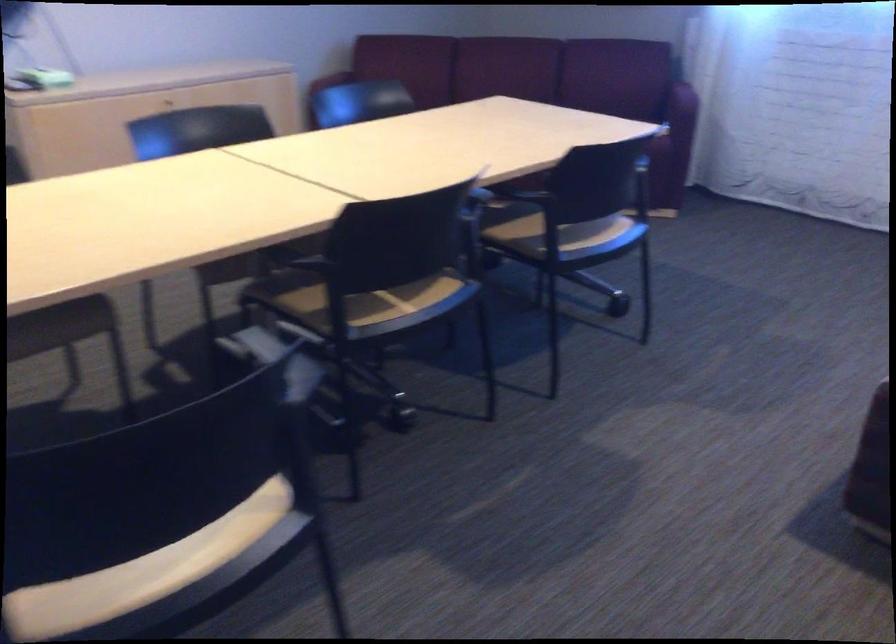
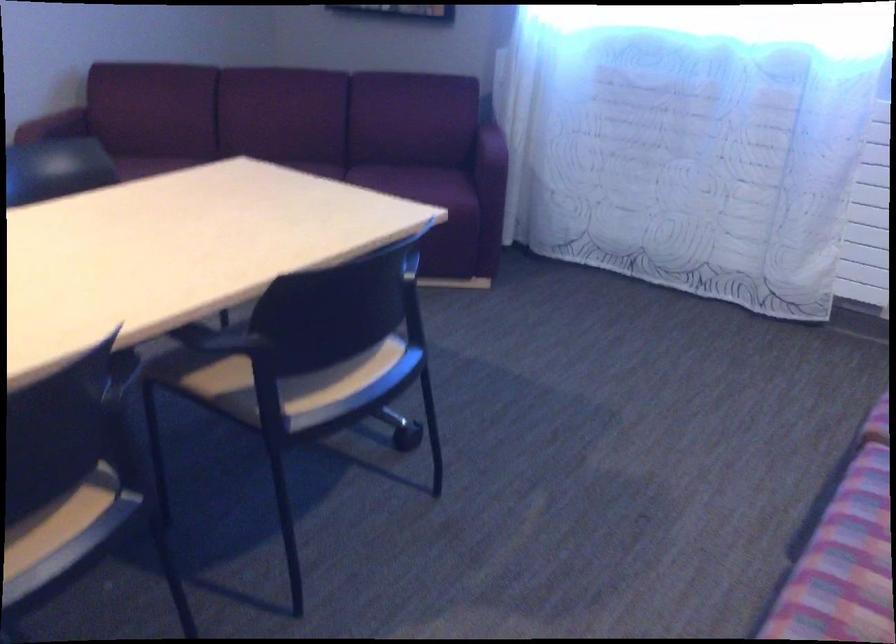
Find the pixel in the second image that matches pixel 319 82 in the first image.

(54, 125)